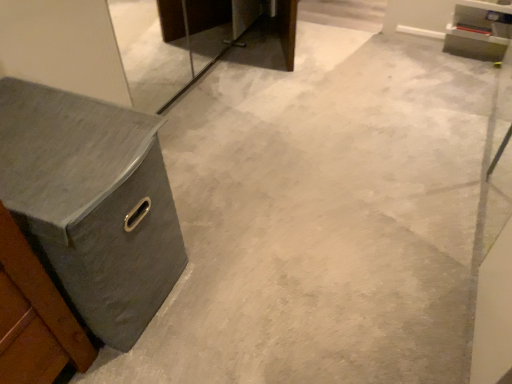
The width and height of the screenshot is (512, 384). Identify the location of matte gray cabinet at upper right. (478, 32).

The image size is (512, 384). Describe the element at coordinates (478, 32) in the screenshot. I see `matte gray cabinet at upper right` at that location.

This screenshot has height=384, width=512. What do you see at coordinates (93, 202) in the screenshot? I see `gray fabric chest of drawers at left` at bounding box center [93, 202].

The image size is (512, 384). What are the coordinates of `gray fabric chest of drawers at left` in the screenshot? It's located at (93, 202).

Measure the distance between point (52,224) and camera.

Point (52,224) and camera are 34.88 inches apart from each other.

Where is `matte gray cabinet at upper right`? matte gray cabinet at upper right is located at coordinates (478, 32).

Between matte gray cabinet at upper right and gray fabric chest of drawers at left, which one appears on the right side from the viewer's perspective?

matte gray cabinet at upper right is more to the right.

Is matte gray cabinet at upper right further to the viewer compared to gray fabric chest of drawers at left?

Yes, it is behind gray fabric chest of drawers at left.

Which point is more forward, (475, 10) or (55, 130)?

The point (55, 130) is closer.

From the image's perspective, between matte gray cabinet at upper right and gray fabric chest of drawers at left, which one is located above?

matte gray cabinet at upper right, from the image's perspective.

From a real-world perspective, is matte gray cabinet at upper right beneath gray fabric chest of drawers at left?

Correct, in the physical world, matte gray cabinet at upper right is lower than gray fabric chest of drawers at left.

Between matte gray cabinet at upper right and gray fabric chest of drawers at left, which one has smaller width?

With smaller width is matte gray cabinet at upper right.

Between matte gray cabinet at upper right and gray fabric chest of drawers at left, which one has less height?

Standing shorter between the two is matte gray cabinet at upper right.

Which of these two, matte gray cabinet at upper right or gray fabric chest of drawers at left, is smaller?

With smaller size is matte gray cabinet at upper right.

Is matte gray cabinet at upper right located outside gray fabric chest of drawers at left?

Indeed, matte gray cabinet at upper right is completely outside gray fabric chest of drawers at left.

Is matte gray cabinet at upper right positioned far away from gray fabric chest of drawers at left?

That's right, there is a large distance between matte gray cabinet at upper right and gray fabric chest of drawers at left.

Does matte gray cabinet at upper right turn towards gray fabric chest of drawers at left?

Yes, matte gray cabinet at upper right is facing gray fabric chest of drawers at left.

Can you tell me how much matte gray cabinet at upper right and gray fabric chest of drawers at left differ in facing direction?

The angle between the facing direction of matte gray cabinet at upper right and the facing direction of gray fabric chest of drawers at left is 90.2 degrees.

At what (x,y) coordinates should I click in order to perform the action: click on the chest of drawers above the matte gray cabinet at upper right (from a real-world perspective). Please return your answer as a coordinate pair (x, y). This screenshot has width=512, height=384. Looking at the image, I should click on (93, 202).

Considering the relative positions of gray fabric chest of drawers at left and matte gray cabinet at upper right in the image provided, is gray fabric chest of drawers at left to the left of matte gray cabinet at upper right from the viewer's perspective?

Yes, gray fabric chest of drawers at left is to the left of matte gray cabinet at upper right.

Looking at this image, which object is further away from the camera taking this photo, gray fabric chest of drawers at left or matte gray cabinet at upper right?

matte gray cabinet at upper right.

Considering the positions of point (66, 268) and point (495, 36), is point (66, 268) closer or farther from the camera than point (495, 36)?

Clearly, point (66, 268) is closer to the camera than point (495, 36).

From the image's perspective, is gray fabric chest of drawers at left positioned above or below matte gray cabinet at upper right?

Based on their image positions, gray fabric chest of drawers at left is located beneath matte gray cabinet at upper right.

From a real-world perspective, who is located lower, gray fabric chest of drawers at left or matte gray cabinet at upper right?

matte gray cabinet at upper right, from a real-world perspective.

Looking at their sizes, would you say gray fabric chest of drawers at left is wider or thinner than matte gray cabinet at upper right?

gray fabric chest of drawers at left is wider than matte gray cabinet at upper right.

Between gray fabric chest of drawers at left and matte gray cabinet at upper right, which one has more height?

gray fabric chest of drawers at left is taller.

Is gray fabric chest of drawers at left bigger or smaller than matte gray cabinet at upper right?

In the image, gray fabric chest of drawers at left appears to be larger than matte gray cabinet at upper right.

Is gray fabric chest of drawers at left surrounding matte gray cabinet at upper right?

No, gray fabric chest of drawers at left does not contain matte gray cabinet at upper right.

Is gray fabric chest of drawers at left not near matte gray cabinet at upper right?

That's right, there is a large distance between gray fabric chest of drawers at left and matte gray cabinet at upper right.

Could you tell me if gray fabric chest of drawers at left is facing matte gray cabinet at upper right?

No, gray fabric chest of drawers at left is not turned towards matte gray cabinet at upper right.

How different are the orientations of gray fabric chest of drawers at left and matte gray cabinet at upper right in degrees?

90.2 degrees.

Measure the distance from gray fabric chest of drawers at left to matte gray cabinet at upper right.

gray fabric chest of drawers at left and matte gray cabinet at upper right are 7.40 feet apart from each other.

Identify the location of the chest of drawers that is in front of the matte gray cabinet at upper right. Image resolution: width=512 pixels, height=384 pixels. (93, 202).

This screenshot has width=512, height=384. Find the location of `the chest of drawers in front of the matte gray cabinet at upper right`. the chest of drawers in front of the matte gray cabinet at upper right is located at coordinates (93, 202).

You are a GUI agent. You are given a task and a screenshot of the screen. Output one action in this format:
    pyautogui.click(x=<x>, y=<y>)
    Task: Click on the chest of drawers on the left of the matte gray cabinet at upper right
    This screenshot has height=384, width=512.
    Given the screenshot: What is the action you would take?
    pyautogui.click(x=93, y=202)